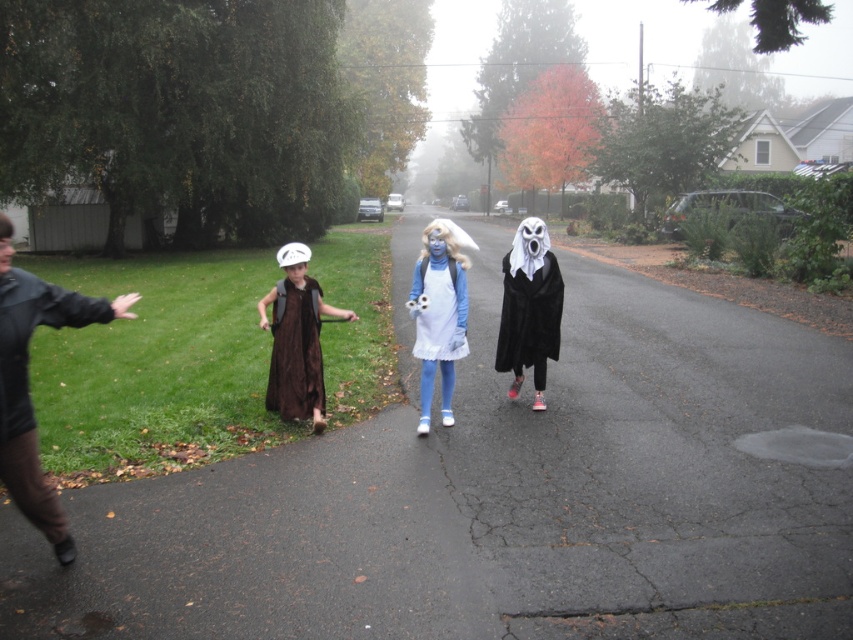
You are a photographer trying to capture a group photo of the blue matte dress at center and the white matte ghost at center. You want to ensure both are fully visible in the frame. Which of the two should you position closer to the edge of the frame to avoid overcrowding?

The blue matte dress at center is narrower than the white matte ghost at center, so positioning the blue matte dress at center closer to the edge would allow both to fit without overcrowding.

You are a costume designer observing the Halloween scene. You need to determine which costume is wider between the white matte ghost at center and the brown velvet vest at center. Based on the scene description, which one is wider?

The brown velvet vest at center is wider than the white matte ghost at center.

You are a costume designer observing the Halloween parade. You need to determine which costume is taller between the dark brown leather jacket at left and the white matte ghost at center. Which one is taller?

The white matte ghost at center is taller than the dark brown leather jacket at left.